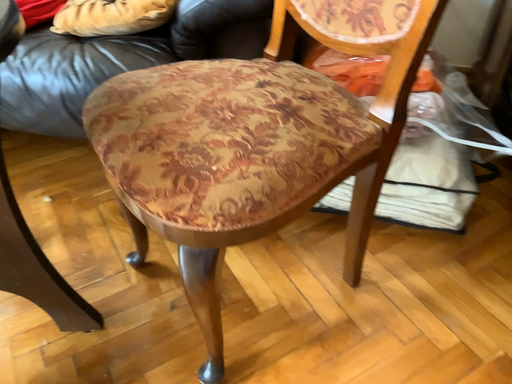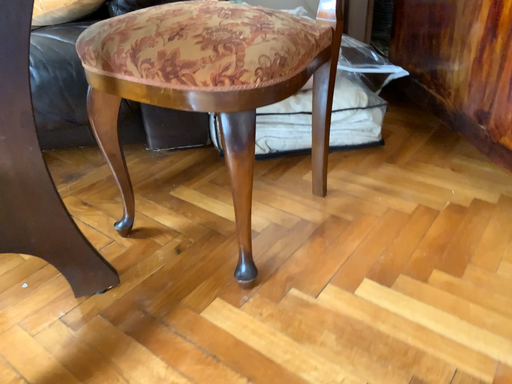
Question: Which way did the camera rotate in the video?

Choices:
 (A) rotated upward
 (B) rotated downward

Answer: (A)